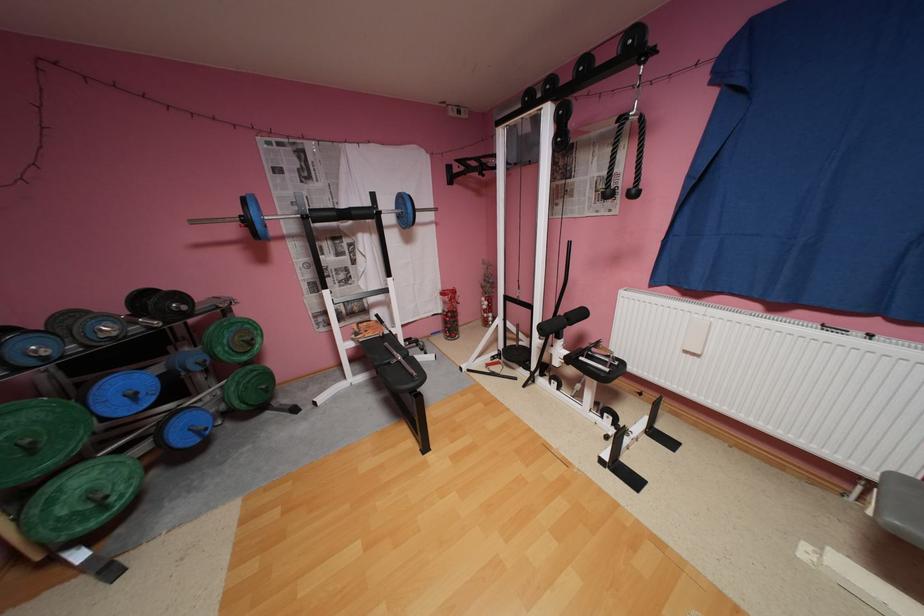
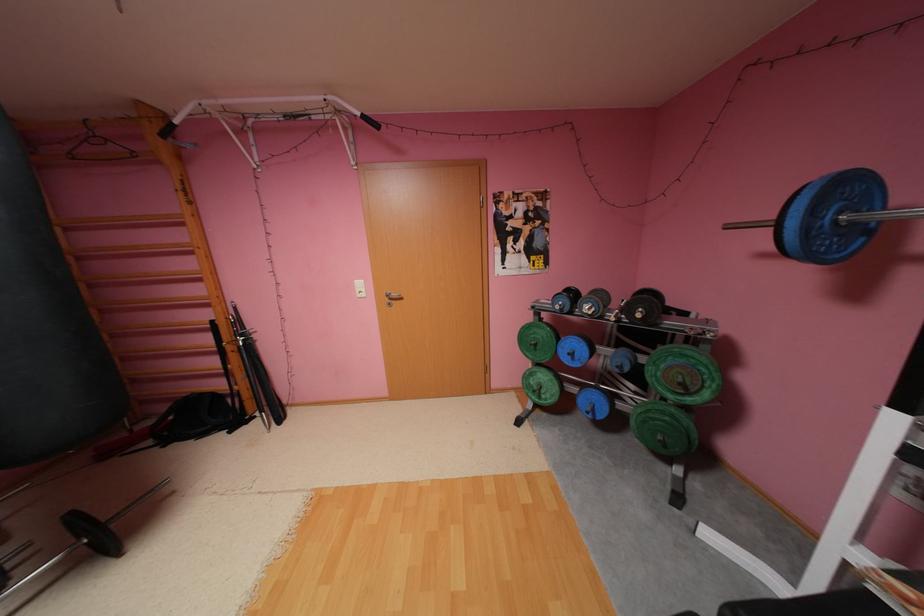
Locate, in the second image, the point that corresponds to point 54,359 in the first image.

(570, 310)